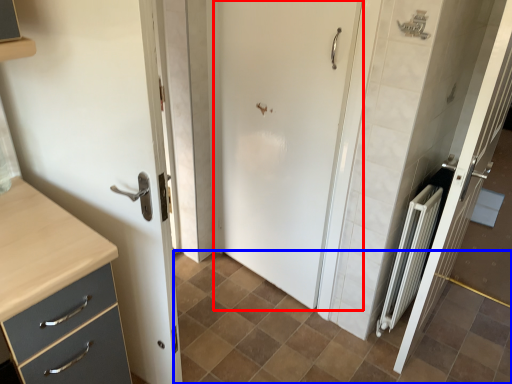
Question: Which object appears closest to the camera in this image, door (highlighted by a red box) or ceramic tile (highlighted by a blue box)?

Choices:
 (A) door
 (B) ceramic tile

Answer: (B)